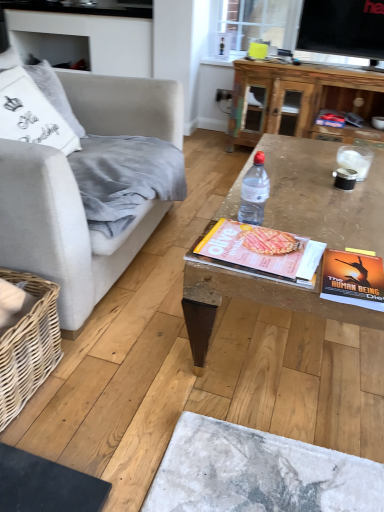
Locate an element on the screen. Image resolution: width=384 pixels, height=512 pixels. vacant area to the right of matte yellow magazine at center is located at coordinates (340, 234).